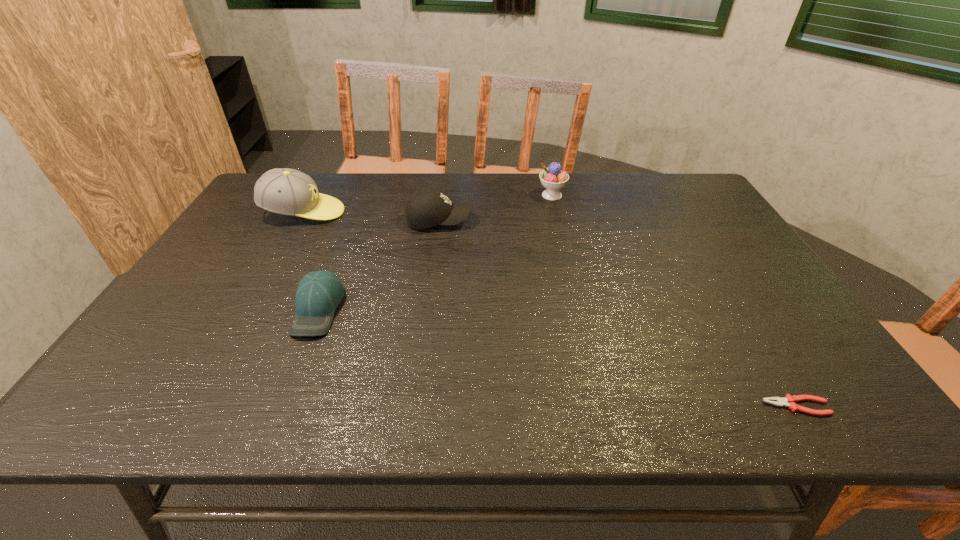
At what (x,y) coordinates should I click in order to perform the action: click on free space located 0.150m on the front-facing side of the third object from left to right. Please return your answer as a coordinate pair (x, y). Image resolution: width=960 pixels, height=540 pixels. Looking at the image, I should click on (520, 220).

You are a GUI agent. You are given a task and a screenshot of the screen. Output one action in this format:
    pyautogui.click(x=<x>, y=<y>)
    Task: Click on the vacant region located 0.180m on the front of the fourth tallest object
    
    Given the screenshot: What is the action you would take?
    pyautogui.click(x=279, y=409)

The image size is (960, 540). Find the location of `free space located 0.220m on the left of the pliers`. free space located 0.220m on the left of the pliers is located at coordinates (655, 406).

You are a GUI agent. You are given a task and a screenshot of the screen. Output one action in this format:
    pyautogui.click(x=<x>, y=<y>)
    Task: Click on the baseball cap that is at the far edge
    The image size is (960, 540).
    Given the screenshot: What is the action you would take?
    pyautogui.click(x=284, y=191)

Where is `icecream present at the far edge`? This screenshot has width=960, height=540. icecream present at the far edge is located at coordinates (552, 178).

Locate an element on the screen. The width and height of the screenshot is (960, 540). object at the near edge is located at coordinates (789, 401).

Find the location of a particular element. This screenshot has height=540, width=960. object present at the left edge is located at coordinates (284, 191).

The height and width of the screenshot is (540, 960). In order to click on object present at the right edge in this screenshot , I will do `click(789, 401)`.

Locate an element on the screen. object at the far left corner is located at coordinates (284, 191).

You are a GUI agent. You are given a task and a screenshot of the screen. Output one action in this format:
    pyautogui.click(x=<x>, y=<y>)
    Task: Click on the object present at the near right corner
    
    Given the screenshot: What is the action you would take?
    pyautogui.click(x=789, y=401)